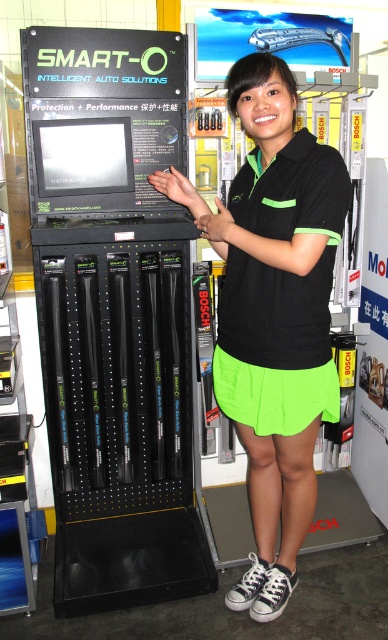
Is neon green fabric skirt at center wider than neon green fabric shorts at center?

Incorrect, neon green fabric skirt at center's width does not surpass neon green fabric shorts at center's.

Does point (263, 225) come farther from viewer compared to point (299, 376)?

No, (263, 225) is in front of (299, 376).

This screenshot has height=640, width=388. I want to click on neon green fabric skirt at center, so click(x=280, y=268).

Is black matte shirt at center shorter than neon green fabric skirt at center?

No, black matte shirt at center is not shorter than neon green fabric skirt at center.

Measure the distance from black matte shirt at center to neon green fabric skirt at center.

7.95 centimeters

Where is `black matte shirt at center`? This screenshot has width=388, height=640. black matte shirt at center is located at coordinates (273, 314).

Can you confirm if black matte shirt at center is positioned below neon green fabric shorts at center?

Incorrect, black matte shirt at center is not positioned below neon green fabric shorts at center.

Can you confirm if black matte shirt at center is positioned to the right of neon green fabric shorts at center?

In fact, black matte shirt at center is to the left of neon green fabric shorts at center.

Which is in front, point (289, 593) or point (299, 380)?

Point (299, 380)

Locate an element on the screen. black matte shirt at center is located at coordinates (273, 314).